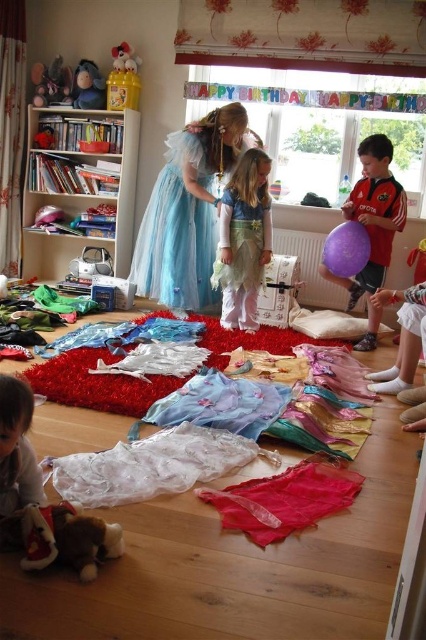
Question: Is white sheer dress at center closer to camera compared to shiny red fabric at center?

Choices:
 (A) yes
 (B) no

Answer: (B)

Question: Is white wooden bookshelf at left to the left of matte plastic toy at upper left from the viewer's perspective?

Choices:
 (A) yes
 (B) no

Answer: (B)

Question: Estimate the real-world distances between objects in this image. Which object is closer to the brown plush toy at lower left?

Choices:
 (A) pastel chiffon dress at center
 (B) plush fabric teddy bear at upper left

Answer: (A)

Question: Estimate the real-world distances between objects in this image. Which object is closer to the pastel chiffon dress at center?

Choices:
 (A) matte red balloon at right
 (B) blue tulle dress at center
 (C) white plush toy at upper left

Answer: (B)

Question: Which object is closer to the camera taking this photo?

Choices:
 (A) shiny red fabric at center
 (B) blue tulle dress at center
 (C) plush fabric teddy bear at upper left

Answer: (A)

Question: Is white sheer dress at center thinner than white plush toy at upper left?

Choices:
 (A) yes
 (B) no

Answer: (B)